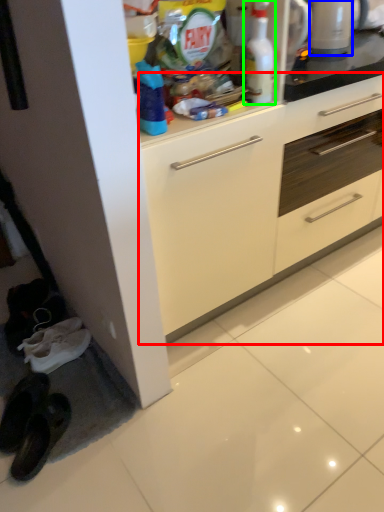
Question: Which is nearer to the cabinetry (highlighted by a red box)? appliance (highlighted by a blue box) or cleaning product (highlighted by a green box).

Choices:
 (A) appliance
 (B) cleaning product

Answer: (B)